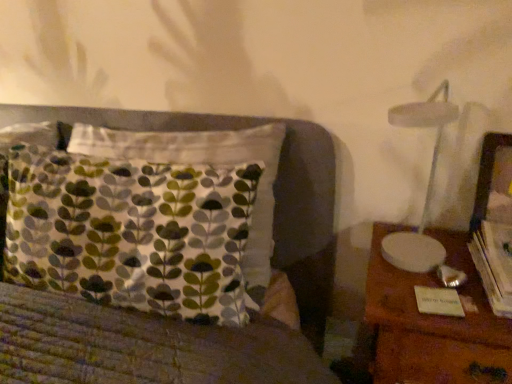
Question: Is wooden nightstand at right aimed at hardcover book at right?

Choices:
 (A) yes
 (B) no

Answer: (B)

Question: From the image's perspective, is wooden nightstand at right on top of hardcover book at right?

Choices:
 (A) yes
 (B) no

Answer: (B)

Question: Can you confirm if wooden nightstand at right is shorter than hardcover book at right?

Choices:
 (A) no
 (B) yes

Answer: (A)

Question: Is wooden nightstand at right to the left of hardcover book at right from the viewer's perspective?

Choices:
 (A) yes
 (B) no

Answer: (A)

Question: From a real-world perspective, does wooden nightstand at right stand above hardcover book at right?

Choices:
 (A) no
 (B) yes

Answer: (A)

Question: Considering the positions of wooden picture frame at right and wooden nightstand at right in the image, is wooden picture frame at right taller or shorter than wooden nightstand at right?

Choices:
 (A) short
 (B) tall

Answer: (A)

Question: Is wooden picture frame at right situated inside wooden nightstand at right or outside?

Choices:
 (A) outside
 (B) inside

Answer: (A)

Question: Considering the relative positions of wooden picture frame at right and wooden nightstand at right in the image provided, is wooden picture frame at right to the left or to the right of wooden nightstand at right?

Choices:
 (A) left
 (B) right

Answer: (B)

Question: Looking at the image, does wooden picture frame at right seem bigger or smaller compared to wooden nightstand at right?

Choices:
 (A) small
 (B) big

Answer: (A)

Question: Does point (496, 266) appear closer or farther from the camera than point (508, 198)?

Choices:
 (A) closer
 (B) farther

Answer: (A)

Question: From a real-world perspective, is hardcover book at right above or below wooden picture frame at right?

Choices:
 (A) above
 (B) below

Answer: (B)

Question: Based on their sizes in the image, would you say hardcover book at right is bigger or smaller than wooden picture frame at right?

Choices:
 (A) small
 (B) big

Answer: (A)

Question: Relative to wooden picture frame at right, is hardcover book at right in front or behind?

Choices:
 (A) front
 (B) behind

Answer: (A)

Question: Is wooden nightstand at right in front of or behind wooden picture frame at right in the image?

Choices:
 (A) front
 (B) behind

Answer: (A)

Question: In terms of width, does wooden nightstand at right look wider or thinner when compared to wooden picture frame at right?

Choices:
 (A) thin
 (B) wide

Answer: (B)